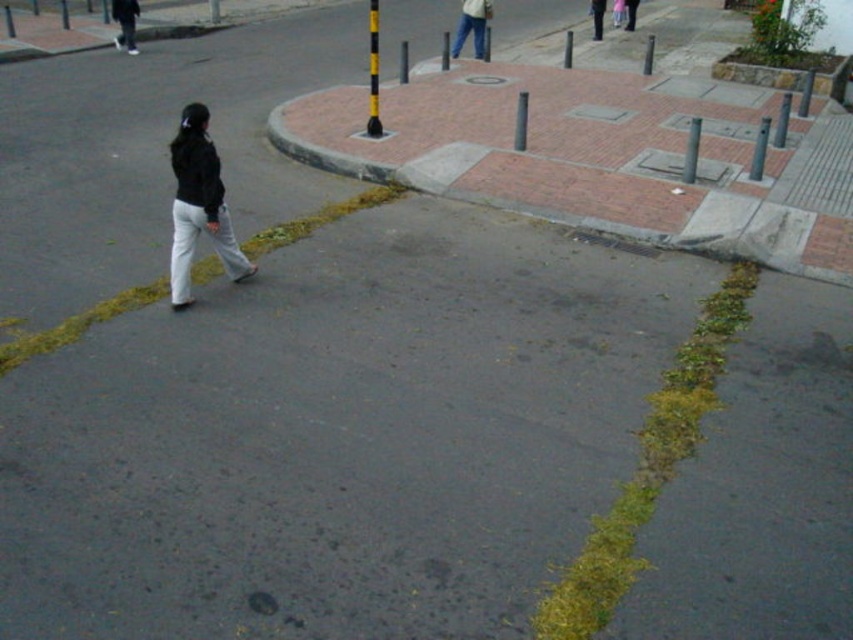
Question: Which object appears farthest from the camera in this image?

Choices:
 (A) jeans at center
 (B) matte black jacket at left

Answer: (A)

Question: Estimate the real-world distances between objects in this image. Which object is farther from the dark blue jeans at center?

Choices:
 (A) jeans at center
 (B) matte black jacket at left
 (C) black matte pants at lower left

Answer: (B)

Question: Where is black matte pants at lower left located in relation to dark blue jeans at center in the image?

Choices:
 (A) right
 (B) left

Answer: (B)

Question: Can you confirm if matte black jacket at left is positioned to the left of dark blue jeans at center?

Choices:
 (A) yes
 (B) no

Answer: (A)

Question: From the image, what is the correct spatial relationship of matte black jacket at left in relation to jeans at center?

Choices:
 (A) below
 (B) above

Answer: (A)

Question: Which point is closer to the camera taking this photo?

Choices:
 (A) (129, 6)
 (B) (207, 212)
 (C) (602, 10)

Answer: (B)